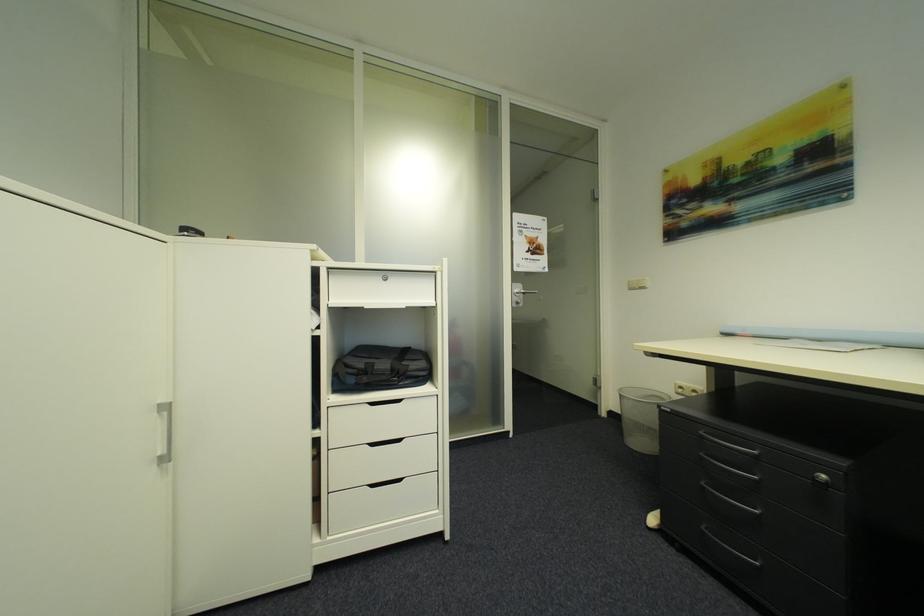
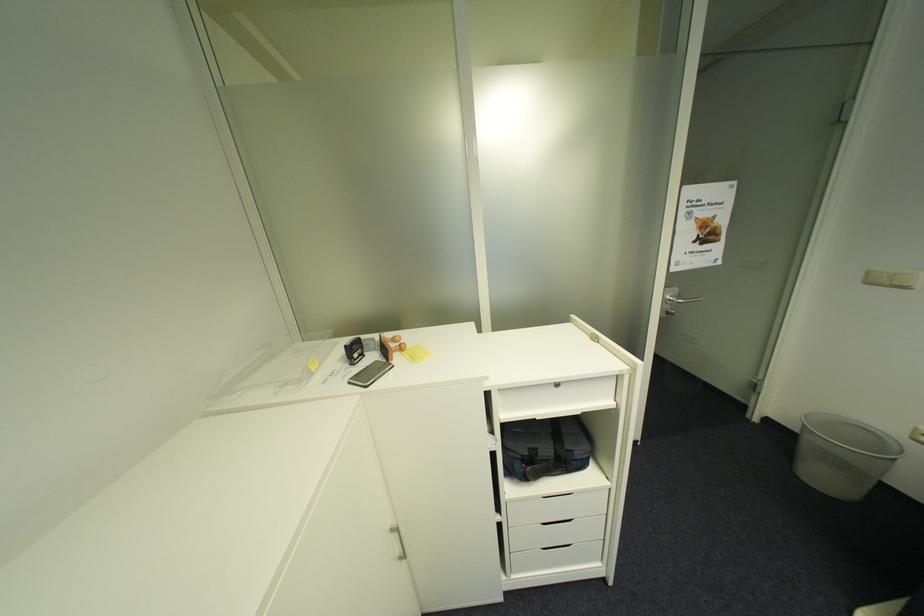
How did the camera likely rotate?

The rotation direction of the camera is left-down.